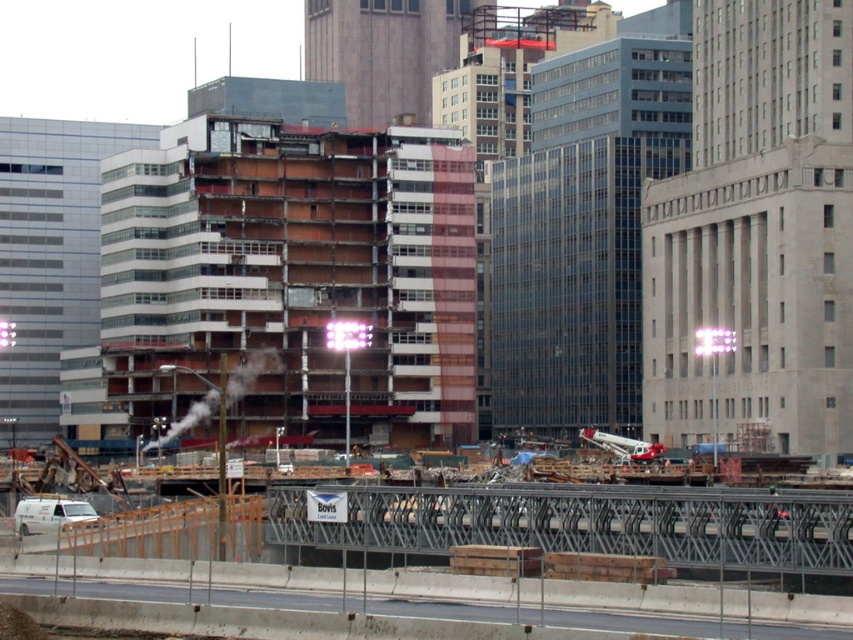
From the picture: You are a construction inspector standing at the point labeled point (297, 273). What type of building are you currently at?

The point (297, 273) indicates that you are at the exposed concrete building at center.